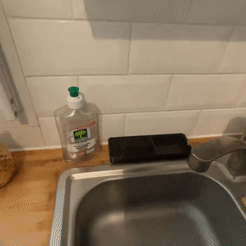
Find the location of a particular element. This screenshot has width=246, height=246. wall is located at coordinates (39, 97).